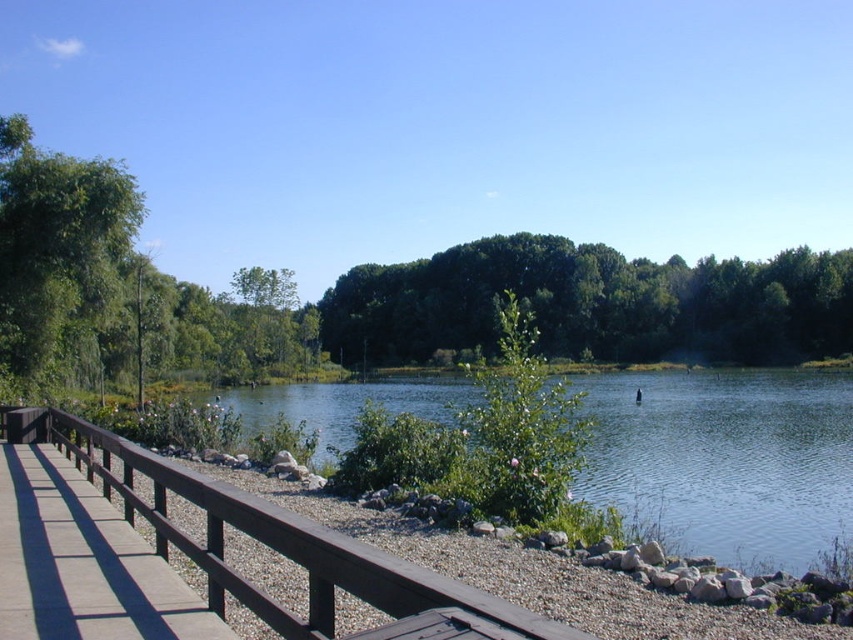
Question: Which point is closer to the camera?

Choices:
 (A) green leafy tree at center
 (B) brown wooden bridge at lower left

Answer: (B)

Question: Can you confirm if green leafy tree at center is smaller than brown wooden bridge at lower left?

Choices:
 (A) yes
 (B) no

Answer: (B)

Question: Can you confirm if clear water at center is positioned above green leafy trees at center?

Choices:
 (A) yes
 (B) no

Answer: (B)

Question: Can you confirm if green leafy tree at center is smaller than brown wooden bridge at lower left?

Choices:
 (A) no
 (B) yes

Answer: (A)

Question: Which of the following is the closest to the observer?

Choices:
 (A) green leafy trees at center
 (B) green leafy tree at left
 (C) brown wood rail at left

Answer: (C)

Question: Which point appears closest to the camera in this image?

Choices:
 (A) click(647, 451)
 (B) click(10, 593)
 (C) click(233, 280)
 (D) click(755, 342)

Answer: (B)